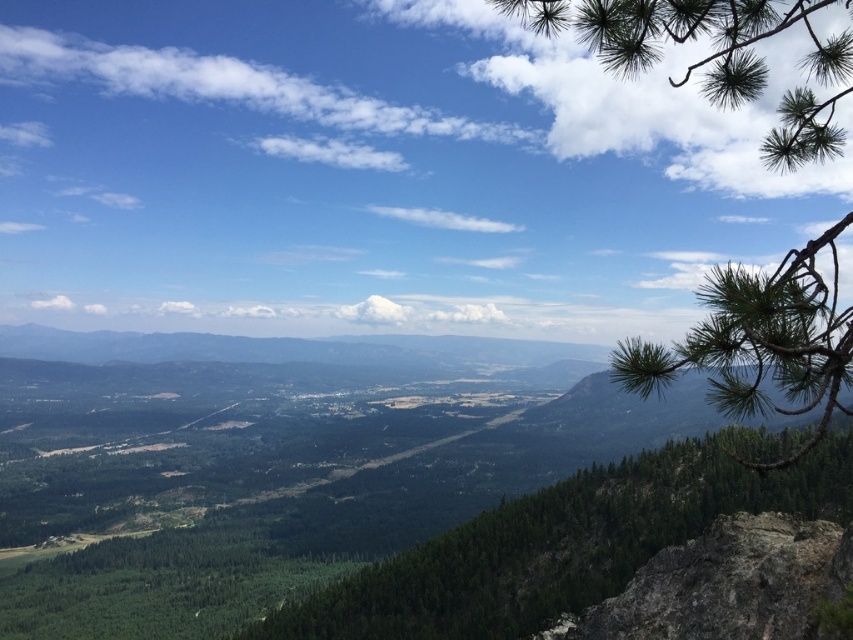
Is green textured tree at center thinner than green needle-like branches at upper right?

Yes, green textured tree at center is thinner than green needle-like branches at upper right.

Image resolution: width=853 pixels, height=640 pixels. What do you see at coordinates (567, 541) in the screenshot?
I see `green textured tree at center` at bounding box center [567, 541].

Is point (727, 483) closer to camera compared to point (744, 410)?

No, it is behind (744, 410).

Find the location of a particular element. green textured tree at center is located at coordinates (567, 541).